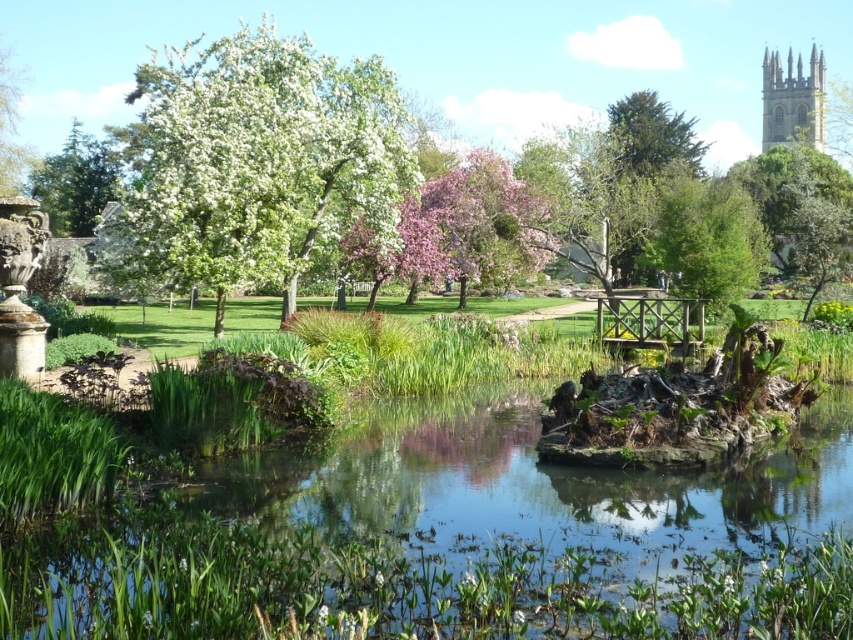
You are standing in the garden and want to walk from the wooden bridge to the pond edge. Which point, point (x=293, y=264) or point (x=799, y=58), is closer to your current position on the bridge?

Point (x=293, y=264) is closer to the camera than point (x=799, y=58), so it is closer to your current position on the bridge.

You are a gardener standing at the edge of the garden pathway near the wooden bridge. You need to place a decorative stone in the clear water at center. According to the garden layout, where exactly should you place the stone to ensure it is in the correct position?

The clear water at center is located at point [392,584], so you should place the decorative stone at those coordinates to ensure it is in the correct position.